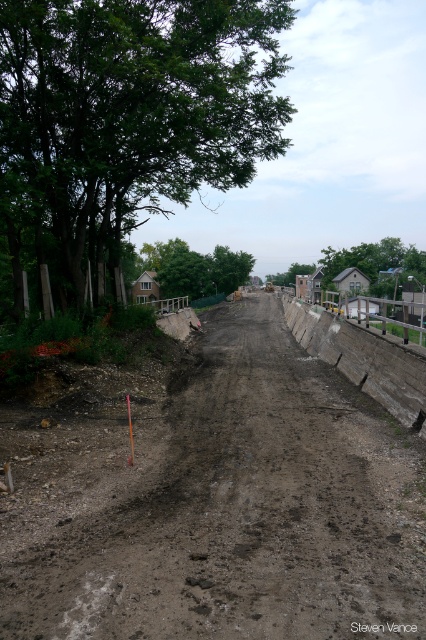
Question: Can you confirm if green leafy tree at left is thinner than green leafy tree at center?

Choices:
 (A) no
 (B) yes

Answer: (A)

Question: Which object is the closest to the green leafy tree at left?

Choices:
 (A) green leafy tree at center
 (B) dull brown dirt track at center
 (C) green leafy tree at upper center

Answer: (B)

Question: Which of the following is the closest to the observer?

Choices:
 (A) green leafy tree at left
 (B) dull brown dirt track at center

Answer: (B)

Question: Does green leafy tree at center have a greater width compared to green leafy tree at upper center?

Choices:
 (A) no
 (B) yes

Answer: (A)

Question: Does green leafy tree at center appear on the right side of green leafy tree at upper center?

Choices:
 (A) yes
 (B) no

Answer: (B)

Question: Which object is the closest to the dull brown dirt track at center?

Choices:
 (A) green leafy tree at upper center
 (B) green leafy tree at left
 (C) green leafy tree at center

Answer: (B)